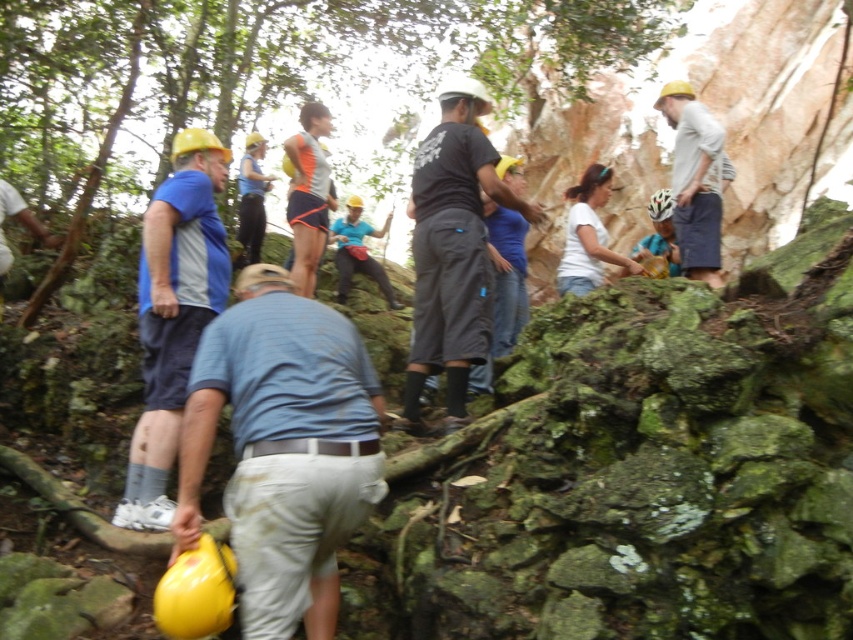
Which is more to the left, black matte shorts at center or blue fabric shirt at left?

Positioned to the left is blue fabric shirt at left.

Who is more distant from viewer, (486, 307) or (193, 298)?

Positioned behind is point (486, 307).

You are a GUI agent. You are given a task and a screenshot of the screen. Output one action in this format:
    pyautogui.click(x=<x>, y=<y>)
    Task: Click on the black matte shorts at center
    Image resolution: width=853 pixels, height=640 pixels.
    Given the screenshot: What is the action you would take?
    pyautogui.click(x=451, y=250)

Is black matte shorts at center shorter than matte white helmet at upper right?

Yes.

Is black matte shorts at center thinner than matte white helmet at upper right?

In fact, black matte shorts at center might be wider than matte white helmet at upper right.

Locate an element on the screen. This screenshot has width=853, height=640. black matte shorts at center is located at coordinates (451, 250).

You are a GUI agent. You are given a task and a screenshot of the screen. Output one action in this format:
    pyautogui.click(x=<x>, y=<y>)
    Task: Click on the black matte shorts at center
    This screenshot has height=640, width=853.
    Given the screenshot: What is the action you would take?
    pyautogui.click(x=451, y=250)

Does blue striped shirt at center have a smaller size compared to matte white helmet at upper right?

Correct, blue striped shirt at center occupies less space than matte white helmet at upper right.

Describe the element at coordinates (283, 449) in the screenshot. I see `blue striped shirt at center` at that location.

I want to click on blue striped shirt at center, so click(x=283, y=449).